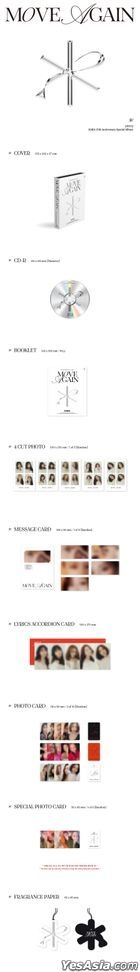
You are a GUI agent. You are given a task and a screenshot of the screen. Output one action in this format:
    pyautogui.click(x=<x>, y=<y>)
    Task: Click on the book cover
    This screenshot has height=972, width=140.
    Given the screenshot: What is the action you would take?
    pyautogui.click(x=69, y=194)